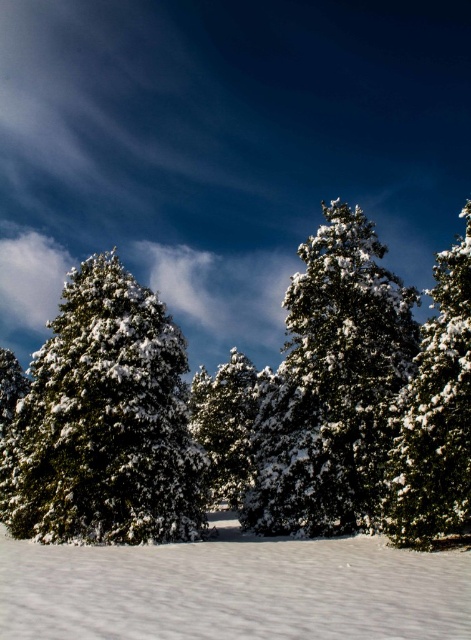
You are planning to place a small birdhouse between the green matte tree at left and the green matte tree at right. Considering their heights, which tree would you choose to hang the birdhouse closer to?

The green matte tree at left is much taller than the green matte tree at right, so you should hang the birdhouse closer to the green matte tree at left for better visibility and space.

You are standing in the winter landscape and want to take a photo of both the point at coordinates point (138, 465) and point (444, 438). Which point should you focus on first to ensure both are in focus?

You should focus on point (138, 465) first because it is closer to the camera than point (444, 438), ensuring both points are within the depth of field.

You are standing in the winter landscape and want to locate the green matte tree at right. According to the coordinates provided, where would you look to find it?

The green matte tree at right is located at point (436, 413).